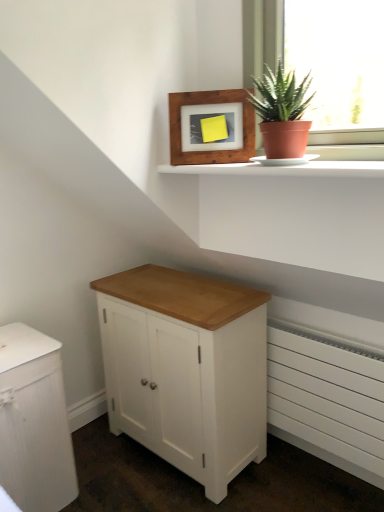
Question: Can you confirm if white wood cabinet at center, which is the 2th chest of drawers from left to right, is shorter than white matte radiator at lower right?

Choices:
 (A) yes
 (B) no

Answer: (B)

Question: Is white wood cabinet at center, which is the 2th chest of drawers from left to right, positioned in front of white matte radiator at lower right?

Choices:
 (A) yes
 (B) no

Answer: (A)

Question: Is white wood cabinet at center, which is the 2th chest of drawers from left to right, looking in the opposite direction of white matte radiator at lower right?

Choices:
 (A) no
 (B) yes

Answer: (A)

Question: Considering the relative sizes of white wood cabinet at center, which is the 2th chest of drawers from left to right, and white matte radiator at lower right in the image provided, is white wood cabinet at center, which is the 2th chest of drawers from left to right, thinner than white matte radiator at lower right?

Choices:
 (A) yes
 (B) no

Answer: (B)

Question: Is white wood cabinet at center, which is the 2th chest of drawers from left to right, to the right of white matte radiator at lower right from the viewer's perspective?

Choices:
 (A) no
 (B) yes

Answer: (A)

Question: From the image's perspective, relative to wooden frame at upper center, is white matte radiator at lower right above or below?

Choices:
 (A) above
 (B) below

Answer: (B)

Question: Based on their positions, is white matte radiator at lower right located to the left or right of wooden frame at upper center?

Choices:
 (A) left
 (B) right

Answer: (B)

Question: Is white matte radiator at lower right bigger or smaller than wooden frame at upper center?

Choices:
 (A) big
 (B) small

Answer: (A)

Question: In the image, is white matte radiator at lower right positioned in front of or behind wooden frame at upper center?

Choices:
 (A) behind
 (B) front

Answer: (A)

Question: From a real-world perspective, is wooden frame at upper center physically located above or below white wood cabinet at center, which is the 2th chest of drawers from left to right?

Choices:
 (A) below
 (B) above

Answer: (B)

Question: In terms of width, does wooden frame at upper center look wider or thinner when compared to white wood cabinet at center, which is the 2th chest of drawers from left to right?

Choices:
 (A) wide
 (B) thin

Answer: (B)

Question: Is wooden frame at upper center bigger or smaller than white wood cabinet at center, acting as the first chest of drawers starting from the right?

Choices:
 (A) big
 (B) small

Answer: (B)

Question: Is wooden frame at upper center inside or outside of white wood cabinet at center, which is the 2th chest of drawers from left to right?

Choices:
 (A) outside
 (B) inside

Answer: (A)

Question: Relative to white wood cabinet at lower left, which is the second chest of drawers from right to left, is wooden frame at upper center in front or behind?

Choices:
 (A) front
 (B) behind

Answer: (B)

Question: From the image's perspective, is wooden frame at upper center located above or below white wood cabinet at lower left, the 1th chest of drawers from the left?

Choices:
 (A) below
 (B) above

Answer: (B)